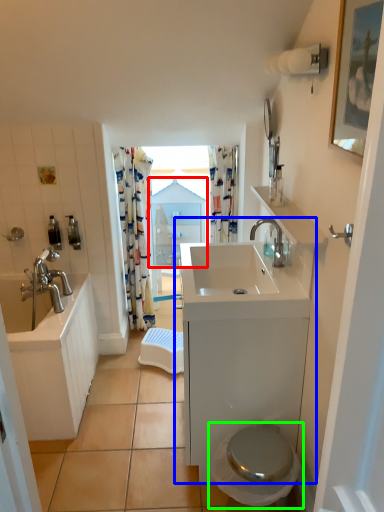
Question: Which is nearer to the medicine cabinet (highlighted by a red box)? bathroom cabinet (highlighted by a blue box) or toilet (highlighted by a green box).

Choices:
 (A) bathroom cabinet
 (B) toilet

Answer: (A)